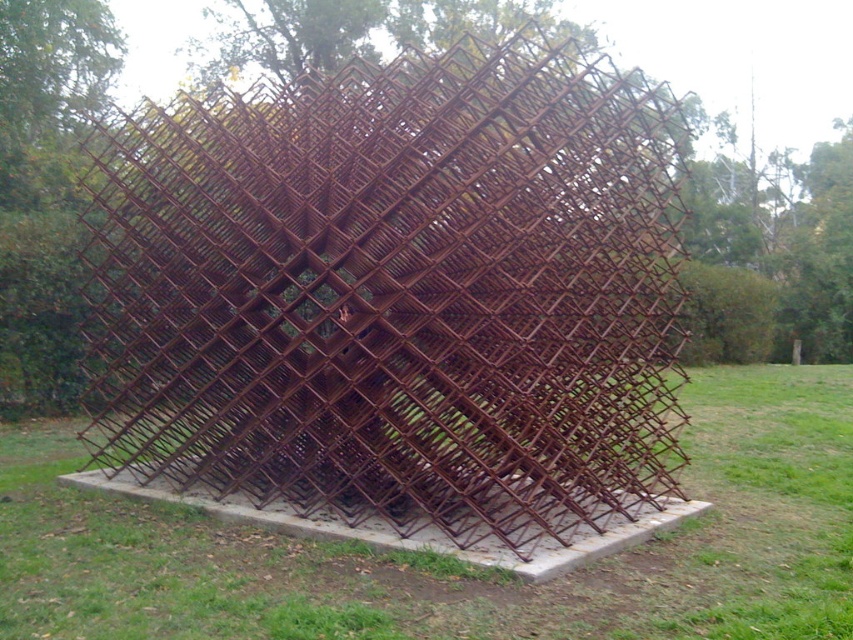
You are an art student trying to sketch the sculpture from the front. You notice two parts of the sculpture labeled as the rusty metal cage at center and the rusty metal structure at center. Which one appears closer to you when viewed from the front?

The rusty metal cage at center appears closer to you because the rusty metal structure at center is behind it when viewed from the front.

You are an art student analyzing the sculpture. You notice two parts of the sculpture labeled as the rusty metal cage at center and the rusty metal structure at center. Which part has a greater overall size?

The rusty metal cage at center is larger in size than the rusty metal structure at center.

You are an artist planning to photograph the rusty metal cage at center and the rusty metal structure at center. To ensure both are visible in the frame, should you position yourself to the right or left of the sculpture?

You should position yourself to the right of the sculpture because the rusty metal cage at center is to the left of the rusty metal structure at center. This way, both objects will be visible in the frame when facing the sculpture from the right side.